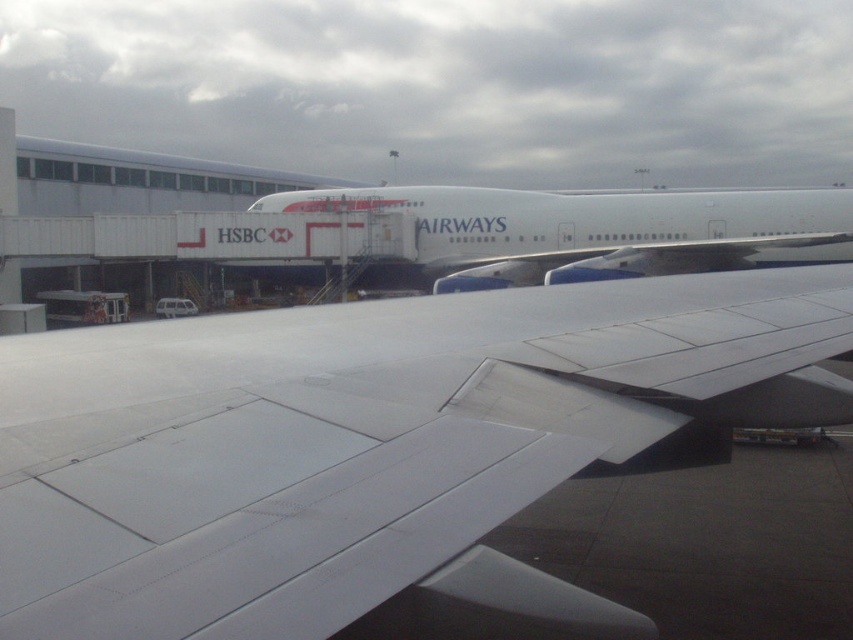
Question: Does white matte wing at center appear under white glossy airplane at center?

Choices:
 (A) yes
 (B) no

Answer: (A)

Question: Among these points, which one is nearest to the camera?

Choices:
 (A) (541, 193)
 (B) (833, 417)

Answer: (B)

Question: Does white matte wing at center have a smaller size compared to white glossy airplane at center?

Choices:
 (A) no
 (B) yes

Answer: (B)

Question: Is white matte wing at center to the left of white glossy airplane at center from the viewer's perspective?

Choices:
 (A) no
 (B) yes

Answer: (B)